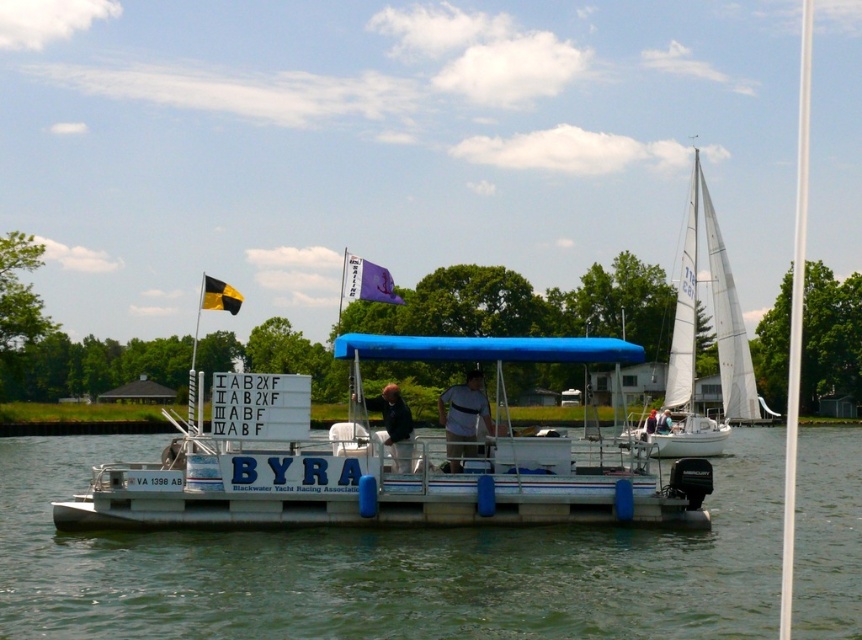
Question: Can you confirm if green water at center is positioned to the left of light blue fabric canopy at center?

Choices:
 (A) yes
 (B) no

Answer: (A)

Question: Can you confirm if white matte shirt at center is smaller than light blue fabric shirt at center?

Choices:
 (A) yes
 (B) no

Answer: (B)

Question: Is black matte jacket at center smaller than light blue fabric canopy at center?

Choices:
 (A) yes
 (B) no

Answer: (A)

Question: Which object is closer to the camera taking this photo?

Choices:
 (A) white matte shirt at center
 (B) white plastic boat at center
 (C) green water at center
 (D) black matte jacket at center

Answer: (C)

Question: Which point is farther to the camera?

Choices:
 (A) black matte jacket at center
 (B) white matte shirt at center

Answer: (B)

Question: Which object is farther from the camera taking this photo?

Choices:
 (A) white matte shirt at center
 (B) light blue fabric shirt at center
 (C) light blue fabric canopy at center

Answer: (B)